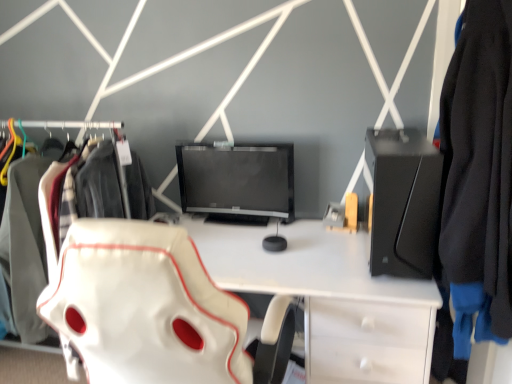
Find the location of a particular element. Image resolution: width=512 pixels, height=384 pixels. vacant area located to the right-hand side of matte black monitor at center is located at coordinates [306, 233].